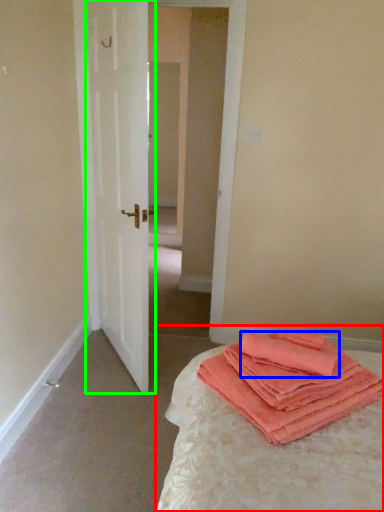
Question: Based on their relative distances, which object is nearer to bed (highlighted by a red box)? Choose from cloth (highlighted by a blue box) and door (highlighted by a green box).

Choices:
 (A) cloth
 (B) door

Answer: (A)